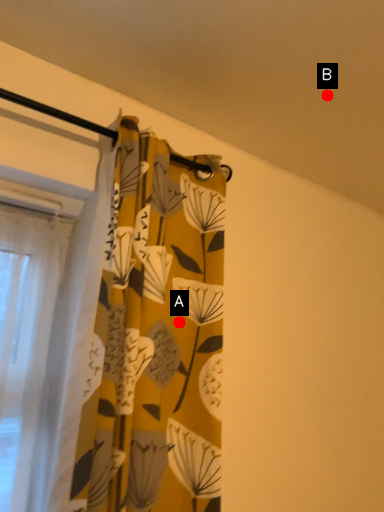
Question: Two points are circled on the image, labeled by A and B beside each circle. Which point is farther from the camera taking this photo?

Choices:
 (A) A is further
 (B) B is further

Answer: (B)